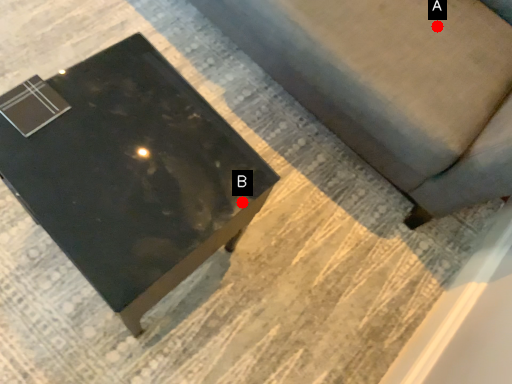
Question: Two points are circled on the image, labeled by A and B beside each circle. Among these points, which one is farthest from the camera?

Choices:
 (A) A is further
 (B) B is further

Answer: (A)